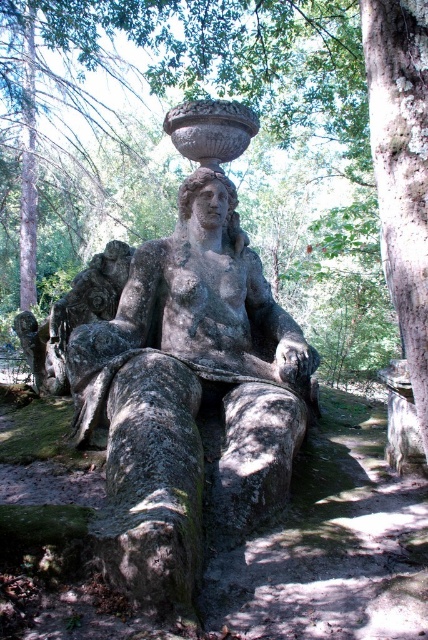
Who is higher up, green rough bark tree at upper center or smooth bark tree trunk at right?

green rough bark tree at upper center

Does point (208, 1) come in front of point (391, 100)?

That is False.

Between point (165, 81) and point (383, 106), which one is positioned behind?

The point (165, 81) is more distant.

This screenshot has width=428, height=640. I want to click on green rough bark tree at upper center, so click(306, 97).

Measure the distance between point (395, 301) and camera.

They are 2.27 meters apart.

Is green rough bark tree at upper center taller than gray stone statue at center?

Yes, green rough bark tree at upper center is taller than gray stone statue at center.

Describe the element at coordinates (306, 97) in the screenshot. This screenshot has height=640, width=428. I see `green rough bark tree at upper center` at that location.

Where is `green rough bark tree at upper center`? green rough bark tree at upper center is located at coordinates (306, 97).

Based on the photo, how much distance is there between smooth bark tree trunk at right and gray stone statue at center?

smooth bark tree trunk at right and gray stone statue at center are 3.13 meters apart from each other.

Who is lower down, smooth bark tree trunk at right or gray stone statue at center?

gray stone statue at center is below.

Is point (419, 228) farther from viewer compared to point (121, 272)?

No, it is not.

Identify the location of smooth bark tree trunk at right. The image size is (428, 640). (401, 168).